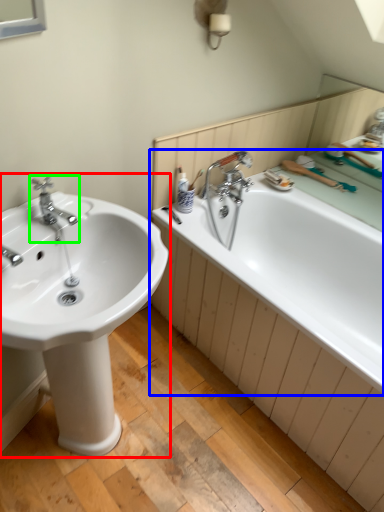
Question: Considering the real-world distances, which object is farthest from sink (highlighted by a red box)? bathtub (highlighted by a blue box) or tap (highlighted by a green box)?

Choices:
 (A) bathtub
 (B) tap

Answer: (A)